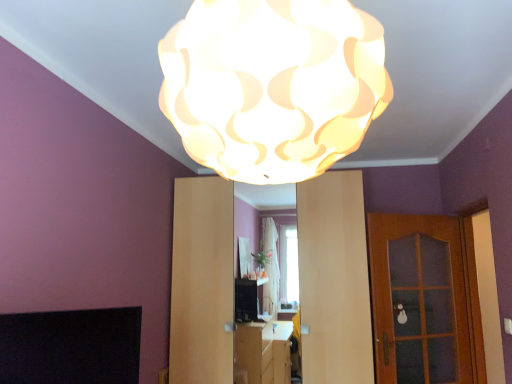
Describe the element at coordinates (335, 279) in the screenshot. Image resolution: width=512 pixels, height=384 pixels. I see `matte wood dresser at center` at that location.

The width and height of the screenshot is (512, 384). I want to click on white matte lampshade at upper center, so click(273, 85).

This screenshot has width=512, height=384. What are the coordinates of `matte wood dresser at center` in the screenshot? It's located at (335, 279).

From the image's perspective, is white matte lampshade at upper center beneath wooden glass door at right?

Incorrect, from the image's perspective, white matte lampshade at upper center is higher than wooden glass door at right.

Is the surface of white matte lampshade at upper center in direct contact with wooden glass door at right?

They are not placed beside each other.

Considering their positions, is white matte lampshade at upper center located in front of or behind wooden glass door at right?

Clearly, white matte lampshade at upper center is in front of wooden glass door at right.

Can you tell me how much white matte lampshade at upper center and wooden glass door at right differ in facing direction?

They differ by 146 degrees in their facing directions.

From a real-world perspective, who is located higher, matte wood dresser at center or black matte fireplace at lower left?

In real-world perspective, matte wood dresser at center is above.

Is matte wood dresser at center aimed at black matte fireplace at lower left?

Yes.

From the image's perspective, between matte wood dresser at center and black matte fireplace at lower left, who is located below?

matte wood dresser at center, from the image's perspective.

Looking at the image, does wooden glass door at right seem bigger or smaller compared to black matte fireplace at lower left?

Clearly, wooden glass door at right is larger in size than black matte fireplace at lower left.

What's the angular difference between wooden glass door at right and black matte fireplace at lower left's facing directions?

The facing directions of wooden glass door at right and black matte fireplace at lower left are 19.7 degrees apart.

From a real-world perspective, between wooden glass door at right and black matte fireplace at lower left, who is vertically lower?

black matte fireplace at lower left.

Which object is closer to the camera taking this photo, wooden glass door at right or black matte fireplace at lower left?

black matte fireplace at lower left is in front.

Is black matte fireplace at lower left oriented away from matte wood dresser at center?

No, black matte fireplace at lower left is not facing the opposite direction of matte wood dresser at center.

Looking at this image, considering the sizes of objects black matte fireplace at lower left and matte wood dresser at center in the image provided, who is thinner, black matte fireplace at lower left or matte wood dresser at center?

black matte fireplace at lower left.

From a real-world perspective, who is located higher, black matte fireplace at lower left or matte wood dresser at center?

matte wood dresser at center is physically above.

Is white matte lampshade at upper center further to the viewer compared to black matte fireplace at lower left?

No, the depth of white matte lampshade at upper center is less than that of black matte fireplace at lower left.

Can we say white matte lampshade at upper center lies outside black matte fireplace at lower left?

Yes, white matte lampshade at upper center is outside of black matte fireplace at lower left.

Can you confirm if white matte lampshade at upper center is positioned to the right of black matte fireplace at lower left?

Correct, you'll find white matte lampshade at upper center to the right of black matte fireplace at lower left.

From a real-world perspective, is white matte lampshade at upper center positioned above or below black matte fireplace at lower left?

From a real-world perspective, white matte lampshade at upper center is physically above black matte fireplace at lower left.

How different are the orientations of black matte fireplace at lower left and white matte lampshade at upper center in degrees?

There is a 126-degree angle between the facing directions of black matte fireplace at lower left and white matte lampshade at upper center.

Could you tell me if black matte fireplace at lower left is turned towards white matte lampshade at upper center?

No, black matte fireplace at lower left is not facing towards white matte lampshade at upper center.

Could white matte lampshade at upper center be considered to be inside black matte fireplace at lower left?

No, white matte lampshade at upper center is not inside black matte fireplace at lower left.

Find the location of a particular element. lamp located above the matte wood dresser at center (from a real-world perspective) is located at coordinates (273, 85).

From the image's perspective, does white matte lampshade at upper center appear lower than matte wood dresser at center?

No, from the image's perspective, white matte lampshade at upper center is not beneath matte wood dresser at center.

Based on the photo, is white matte lampshade at upper center far from matte wood dresser at center?

Yes, white matte lampshade at upper center and matte wood dresser at center are located far from each other.

Is matte wood dresser at center at the back of white matte lampshade at upper center?

No.

Identify the location of door below the white matte lampshade at upper center (from the image's perspective). (424, 300).

Find the location of a particular element. The image size is (512, 384). fireplace on the left of matte wood dresser at center is located at coordinates (71, 347).

Which object lies nearer to the anchor point wooden glass door at right, matte wood dresser at center or black matte fireplace at lower left?

Among the two, matte wood dresser at center is located nearer to wooden glass door at right.

Considering their positions, is wooden glass door at right positioned further to matte wood dresser at center than black matte fireplace at lower left?

black matte fireplace at lower left.

Based on the photo, looking at the image, which one is located closer to black matte fireplace at lower left, matte wood dresser at center or white matte lampshade at upper center?

white matte lampshade at upper center.

Looking at this image, when comparing their distances from black matte fireplace at lower left, does matte wood dresser at center or wooden glass door at right seem further?

wooden glass door at right is further to black matte fireplace at lower left.

Which object lies further to the anchor point white matte lampshade at upper center, matte wood dresser at center or wooden glass door at right?

wooden glass door at right.

In the scene shown: Based on their spatial positions, is wooden glass door at right or matte wood dresser at center further from white matte lampshade at upper center?

wooden glass door at right.

Looking at the image, which one is located closer to matte wood dresser at center, white matte lampshade at upper center or black matte fireplace at lower left?

black matte fireplace at lower left is positioned closer to the anchor matte wood dresser at center.

From the image, which object appears to be farther from black matte fireplace at lower left, white matte lampshade at upper center or wooden glass door at right?

wooden glass door at right is further to black matte fireplace at lower left.

I want to click on fireplace between white matte lampshade at upper center and wooden glass door at right in the front-back direction, so click(71, 347).

Locate an element on the screen. dresser between white matte lampshade at upper center and wooden glass door at right along the z-axis is located at coordinates (335, 279).

Where is `dresser between black matte fireplace at lower left and wooden glass door at right from left to right`? Image resolution: width=512 pixels, height=384 pixels. dresser between black matte fireplace at lower left and wooden glass door at right from left to right is located at coordinates (335, 279).

The image size is (512, 384). In order to click on fireplace positioned between white matte lampshade at upper center and matte wood dresser at center from near to far in this screenshot , I will do `click(71, 347)`.